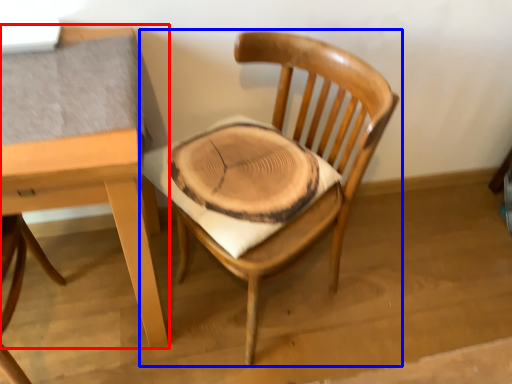
Question: Among these objects, which one is farthest to the camera, table (highlighted by a red box) or chair (highlighted by a blue box)?

Choices:
 (A) table
 (B) chair

Answer: (B)